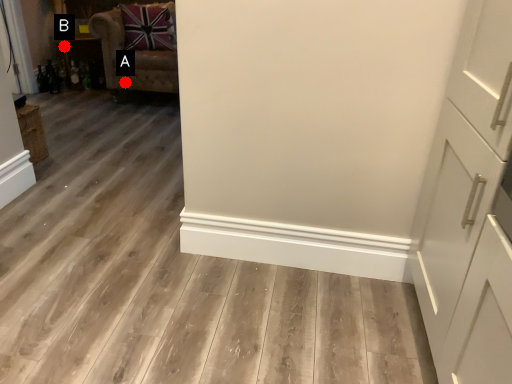
Question: Two points are circled on the image, labeled by A and B beside each circle. Which point appears farthest from the camera in this image?

Choices:
 (A) A is further
 (B) B is further

Answer: (B)